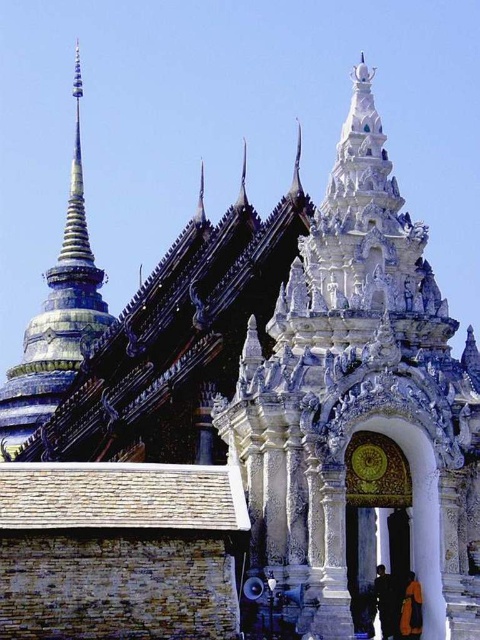
You are a visitor standing in front of the temple structure. You notice the blue lacquered spire at upper left and the dark blue fabric at lower center. Which object is located to the left of the other?

The blue lacquered spire at upper left is positioned on the left side of dark blue fabric at lower center.

You are standing in front of the temple structure and want to determine the relative positions of two points marked on the gateway. Which point is closer to you, point (2, 436) or point (382, 570)?

Point (2, 436) is further to the camera than point (382, 570), so point (382, 570) is closer to you.

You are standing in front of the temple structure. There is a point marked at coordinates (57, 317). What does this point indicate?

The point at coordinates (57, 317) indicates the location of the blue lacquered spire at upper left.